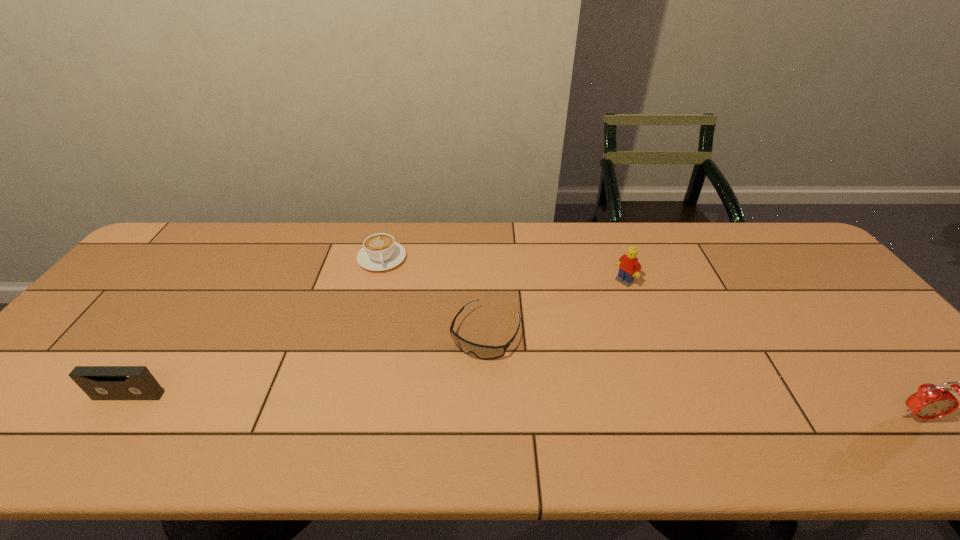
The width and height of the screenshot is (960, 540). What are the coordinates of `vacant space located on the front-facing side of the Lego` in the screenshot? It's located at (552, 332).

At what (x,y) coordinates should I click in order to perform the action: click on free space located on the front-facing side of the Lego. Please return your answer as a coordinate pair (x, y). This screenshot has width=960, height=540. Looking at the image, I should click on (528, 349).

The height and width of the screenshot is (540, 960). I want to click on vacant position located 0.380m on the front-facing side of the Lego, so click(525, 352).

Where is `free space located on the side of the second object from left to right with the handle`? This screenshot has height=540, width=960. free space located on the side of the second object from left to right with the handle is located at coordinates click(396, 348).

At what (x,y) coordinates should I click in order to perform the action: click on vacant space located 0.220m on the side of the second object from left to right with the handle. Please return your answer as a coordinate pair (x, y). The height and width of the screenshot is (540, 960). Looking at the image, I should click on (392, 326).

I want to click on vacant space located on the side of the second object from left to right with the handle, so click(390, 310).

Where is `object that is at the far edge`? This screenshot has height=540, width=960. object that is at the far edge is located at coordinates (380, 252).

Image resolution: width=960 pixels, height=540 pixels. I want to click on videotape at the near edge, so click(x=99, y=382).

Where is `alarm clock at the near edge`? The height and width of the screenshot is (540, 960). alarm clock at the near edge is located at coordinates (930, 402).

Find the location of `object positioned at the right edge`. object positioned at the right edge is located at coordinates (930, 402).